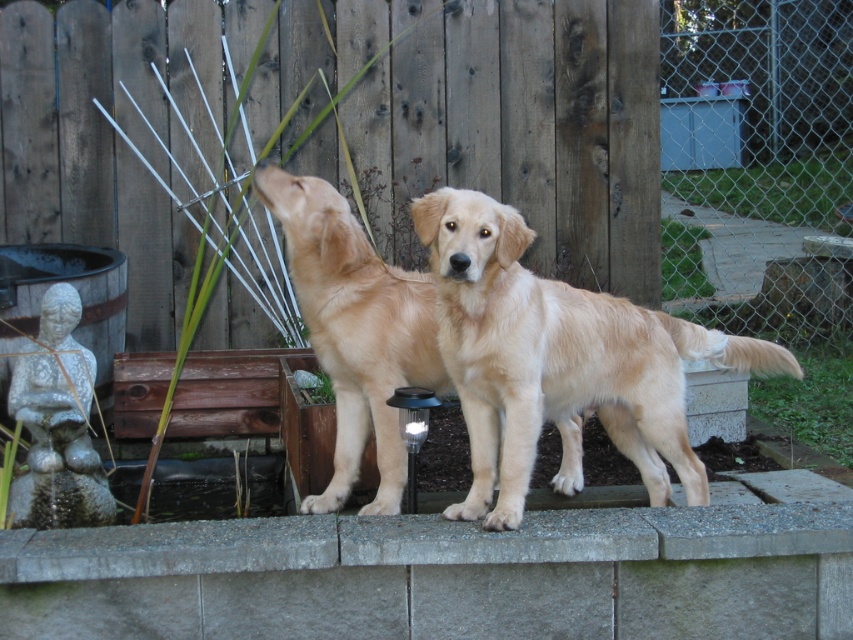
Is the position of wooden fence at center less distant than that of golden fur dog at center?

No.

Which is in front, point (363, 172) or point (425, 285)?

Positioned in front is point (425, 285).

Identify the location of wooden fence at center. (454, 136).

In the scene shown: Is wooden fence at center taller than gray concrete ledge at center?

Indeed, wooden fence at center has a greater height compared to gray concrete ledge at center.

Does wooden fence at center appear on the right side of gray concrete ledge at center?

In fact, wooden fence at center is to the left of gray concrete ledge at center.

Is point (755, 196) behind point (469, 545)?

Yes.

The width and height of the screenshot is (853, 640). Identify the location of wooden fence at center. (454, 136).

Between wooden fence at center and golden retriever at center, which one is positioned lower?

Positioned lower is golden retriever at center.

Is point (421, 1) farther from camera compared to point (662, 321)?

Yes, it is behind point (662, 321).

Locate an element on the screen. wooden fence at center is located at coordinates (454, 136).